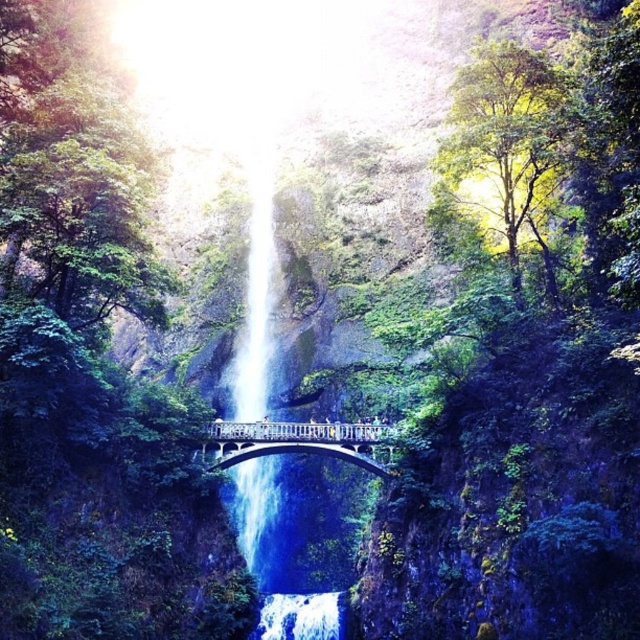
Does clear blue water at center appear on the right side of white stone bridge at center?

No, clear blue water at center is not to the right of white stone bridge at center.

In the scene shown: Can you confirm if clear blue water at center is shorter than white stone bridge at center?

Incorrect, clear blue water at center's height does not fall short of white stone bridge at center's.

The width and height of the screenshot is (640, 640). What are the coordinates of `clear blue water at center` in the screenshot? It's located at (257, 289).

Is white stone bridge at center further to the viewer compared to white frothy water at center?

Yes.

Is point (266, 432) farther from camera compared to point (339, 600)?

Yes, it is behind point (339, 600).

Identify the location of white stone bridge at center. [294, 442].

Is point (269, 304) in front of point (312, 596)?

No.

Is clear blue water at center to the left of white frothy water at center from the viewer's perspective?

Yes, clear blue water at center is to the left of white frothy water at center.

At what (x,y) coordinates should I click in order to perform the action: click on clear blue water at center. Please return your answer as a coordinate pair (x, y). The image size is (640, 640). Looking at the image, I should click on (257, 289).

At what (x,y) coordinates should I click in order to perform the action: click on clear blue water at center. Please return your answer as a coordinate pair (x, y). Looking at the image, I should click on (257, 289).